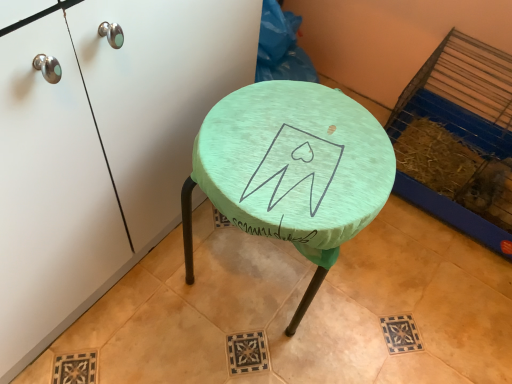
Where is `free spot below teal fabric stool at center (from a real-world perspective)`? free spot below teal fabric stool at center (from a real-world perspective) is located at coordinates (262, 276).